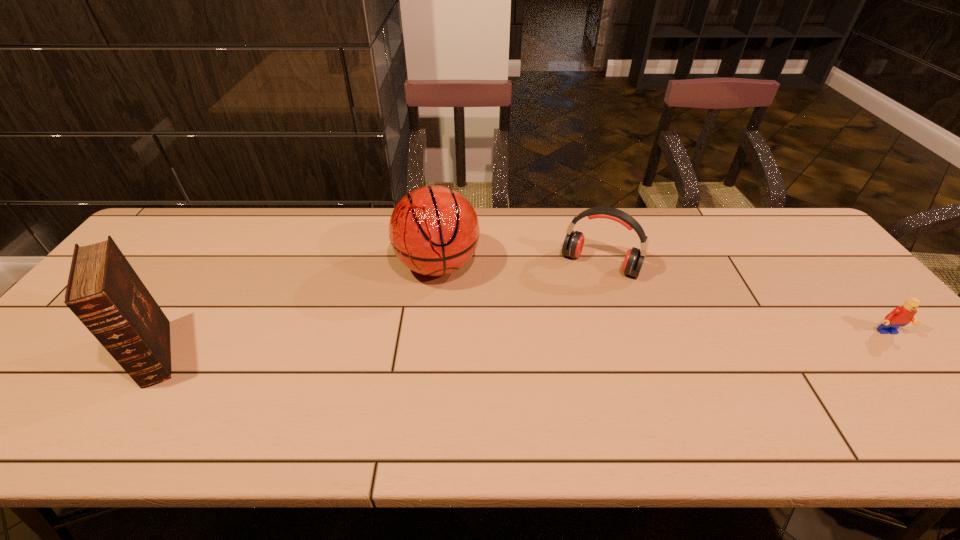
In the image, there is a desktop. At what (x,y) coordinates should I click in order to perform the action: click on vacant region at the left edge. Please return your answer as a coordinate pair (x, y). Looking at the image, I should click on (84, 355).

Identify the location of vacant area at the right edge. The image size is (960, 540). (830, 265).

The height and width of the screenshot is (540, 960). In the image, there is a desktop. Identify the location of free space at the far left corner. (204, 211).

Locate an element on the screen. The image size is (960, 540). free space at the near right corner of the desktop is located at coordinates (865, 375).

This screenshot has height=540, width=960. What are the coordinates of `free point between the shortest object and the Bible` in the screenshot? It's located at (521, 343).

Image resolution: width=960 pixels, height=540 pixels. I want to click on free spot between the earphone and the shortest object, so click(x=743, y=299).

I want to click on vacant area between the Bible and the third object from left to right, so click(x=378, y=308).

Find the location of a particular element. free space between the leftmost object and the earphone is located at coordinates [x=378, y=308].

I want to click on vacant area that lies between the third tallest object and the second object from left to right, so click(519, 265).

Identify the location of free point between the second object from right to left and the Bible. (378, 308).